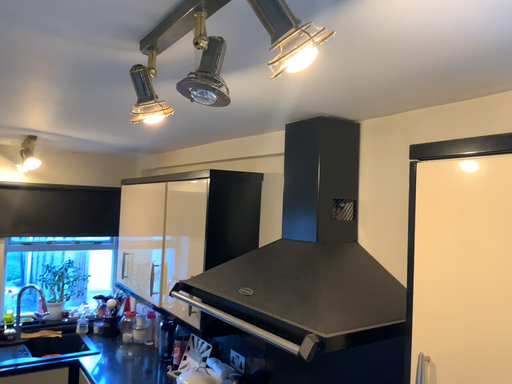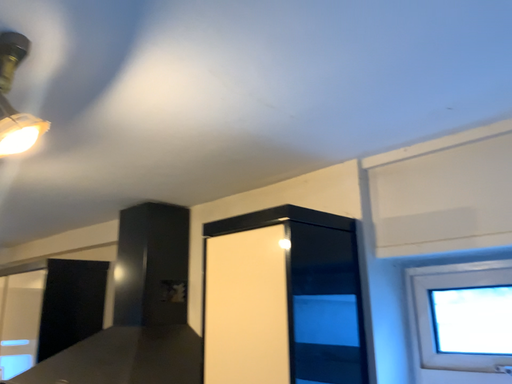
Question: How did the camera likely rotate when shooting the video?

Choices:
 (A) rotated upward
 (B) rotated downward

Answer: (A)